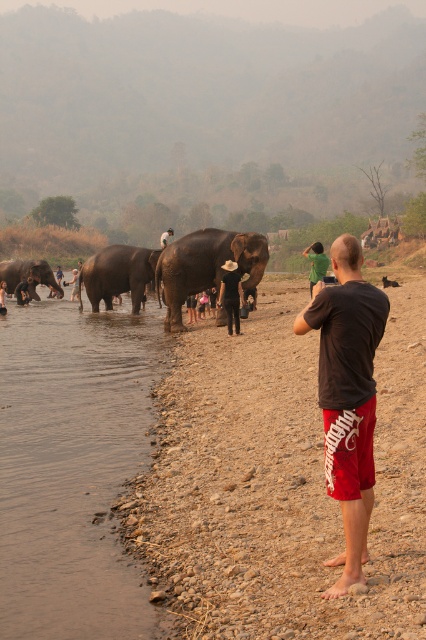
You are standing at the riverside and want to take a photo of the elephants. There are two points marked on your map at coordinates point (x=164, y=352) and point (x=316, y=307). Which point should you choose to get a closer view of the elephants?

You should choose point (x=164, y=352) because it is closer to the camera, allowing for a closer view of the elephants compared to point (x=316, y=307).

You are a wildlife photographer trying to capture a photo of the dark brown textured elephant at center and the gray matte elephant at left in the same frame. Your camera has a maximum focus range that allows capturing subjects within 5 meters. Can you include both elephants in a single photo without moving your position?

The dark brown textured elephant at center and gray matte elephant at left are 5.27 meters apart. Since the distance between them exceeds the camera maximum focus range of 5 meters, you cannot include both elephants in a single photo without moving your position.